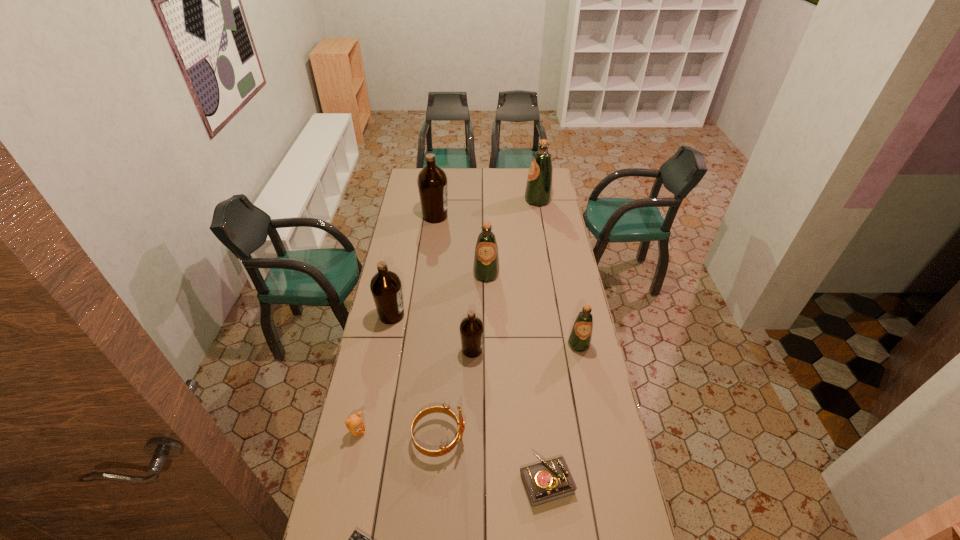
I want to click on vacant space located 0.400m on the label of the fourth farthest olive oil, so click(497, 315).

You are a GUI agent. You are given a task and a screenshot of the screen. Output one action in this format:
    pyautogui.click(x=<x>, y=<y>)
    Task: Click on the blank space located 0.380m on the front-facing side of the smallest green olive oil
    This screenshot has width=960, height=540.
    Given the screenshot: What is the action you would take?
    pyautogui.click(x=599, y=443)

The width and height of the screenshot is (960, 540). What are the coordinates of `vacant area located 0.140m on the label of the nearest brown olive oil` in the screenshot? It's located at click(518, 350).

This screenshot has width=960, height=540. I want to click on vacant space located on the front-facing side of the red tiara, so click(x=550, y=438).

Image resolution: width=960 pixels, height=540 pixels. Find the location of `vacant region located on the face of the teddy bear`. vacant region located on the face of the teddy bear is located at coordinates click(403, 431).

Locate an element on the screen. vacant space located 0.060m on the left of the ninth tallest object is located at coordinates (502, 482).

Identify the location of teddy bear located in the left edge section of the desktop. This screenshot has height=540, width=960. (354, 423).

Locate an element on the screen. Image resolution: width=960 pixels, height=540 pixels. diary situated at the right edge is located at coordinates coord(547,481).

You are a GUI agent. You are given a task and a screenshot of the screen. Output one action in this format:
    pyautogui.click(x=<x>, y=<y>)
    Task: Click on the vacant space at the far edge
    
    Given the screenshot: What is the action you would take?
    pyautogui.click(x=503, y=184)

In order to click on blank space at the left edge of the desktop in this screenshot , I will do `click(408, 225)`.